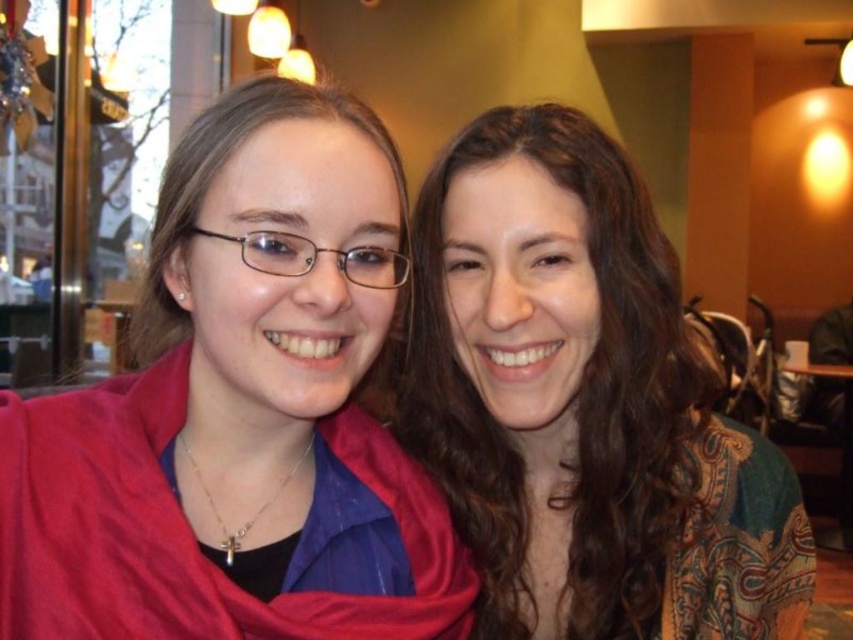
Question: Does matte red scarf at left appear on the right side of matte brown hair at center?

Choices:
 (A) no
 (B) yes

Answer: (A)

Question: Can you confirm if matte red scarf at left is positioned below matte brown hair at center?

Choices:
 (A) yes
 (B) no

Answer: (B)

Question: Is matte red scarf at left further to camera compared to matte brown hair at center?

Choices:
 (A) yes
 (B) no

Answer: (B)

Question: Which of the following is the closest to the observer?

Choices:
 (A) (355, 125)
 (B) (701, 620)

Answer: (A)